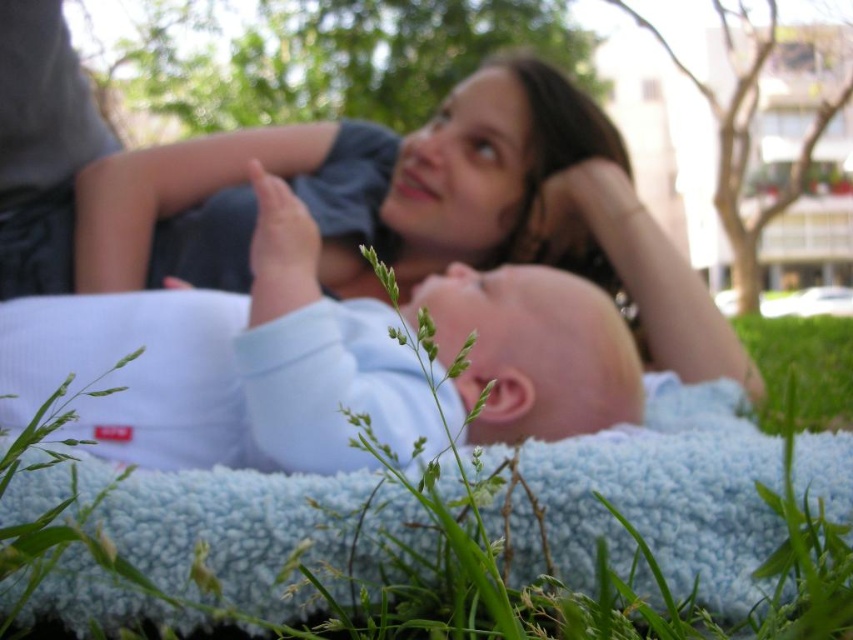
Question: Is light blue fabric at center further to the viewer compared to green soft grass at lower right?

Choices:
 (A) no
 (B) yes

Answer: (A)

Question: Considering the real-world distances, which object is farthest from the light blue fabric at center?

Choices:
 (A) green fuzzy grass at lower center
 (B) green soft grass at lower right

Answer: (B)

Question: Among these objects, which one is nearest to the camera?

Choices:
 (A) light blue fabric at center
 (B) green fuzzy grass at lower center
 (C) green soft grass at lower right

Answer: (B)

Question: Estimate the real-world distances between objects in this image. Which object is farther from the light blue fabric at center?

Choices:
 (A) green soft grass at lower right
 (B) green fuzzy grass at lower center

Answer: (A)

Question: Is light blue fabric at center wider than green fuzzy grass at lower center?

Choices:
 (A) no
 (B) yes

Answer: (B)

Question: From the image, what is the correct spatial relationship of light blue fabric at center in relation to green fuzzy grass at lower center?

Choices:
 (A) below
 (B) above

Answer: (B)